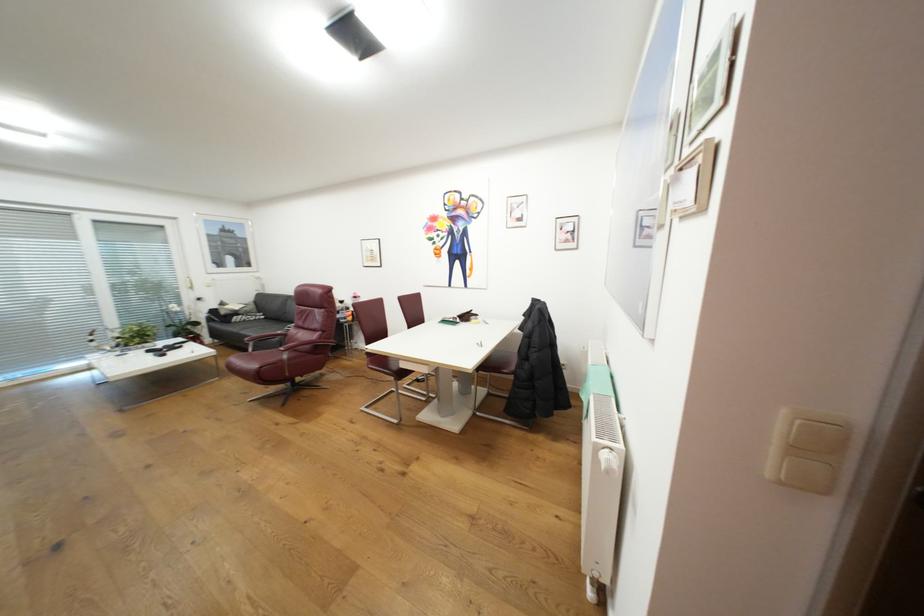
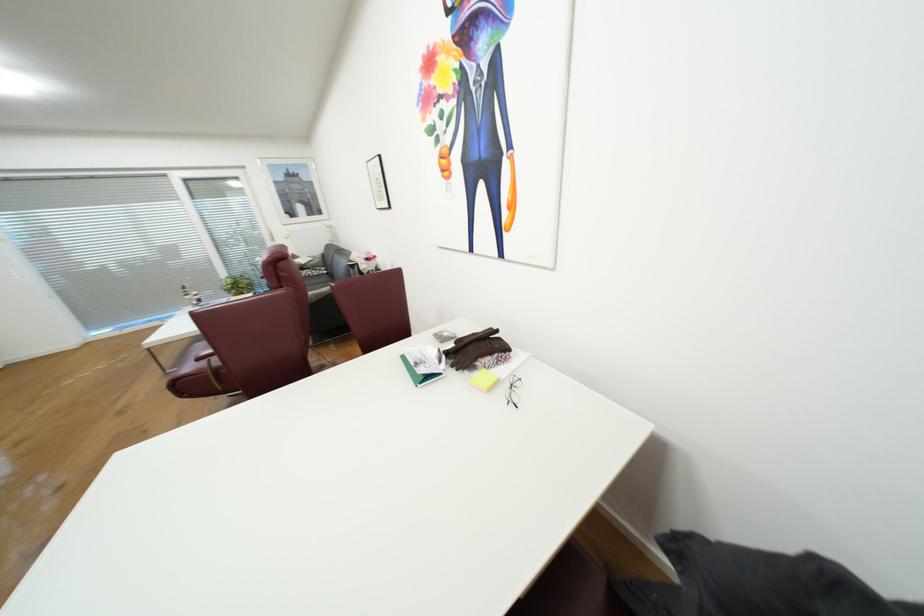
In the second image, find the point that corresponds to [480,321] in the first image.

(492, 373)